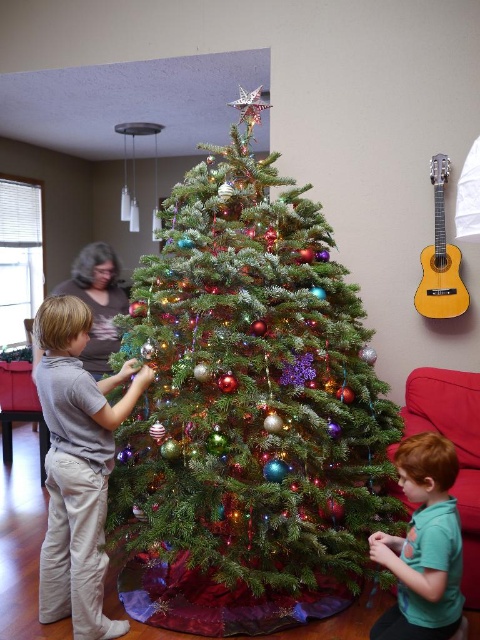
In the scene shown: You are a photographer standing in the room where the Christmas tree is decorated. You need to take a photo that includes both the green matte shirt at lower right and the yellow wood guitar at upper right. Considering their heights, which object will appear closer to the bottom of the photo?

The green matte shirt at lower right has a lesser height compared to the yellow wood guitar at upper right, so it will appear closer to the bottom of the photo.

You are a parent observing the children decorating the Christmas tree. You notice the light gray cotton shirt at center and the green matte shirt at lower right. Which child is closer to you?

The light gray cotton shirt at center is closer to you because the green matte shirt at lower right is behind it.